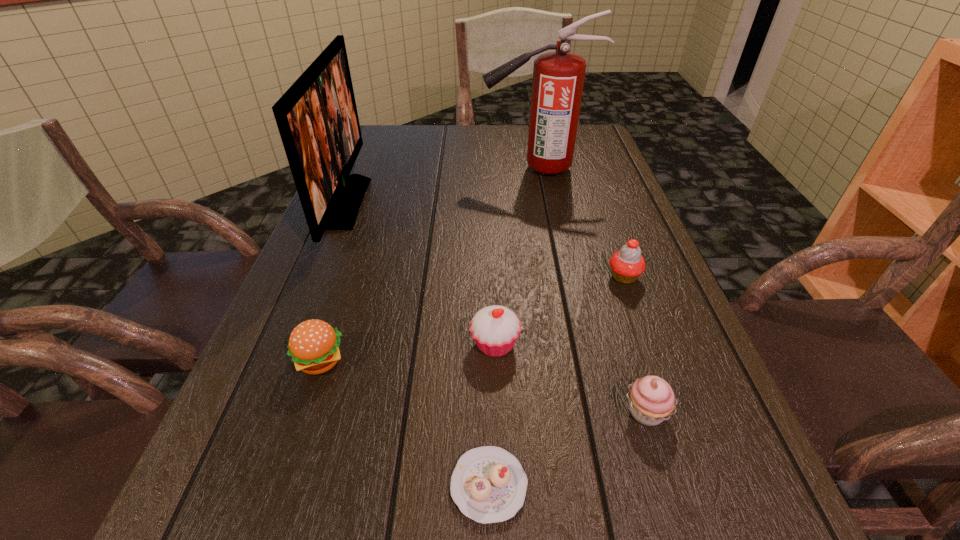
This screenshot has width=960, height=540. I want to click on fire extinguisher that is at the right edge, so [x=558, y=77].

In the image, there is a desktop. Find the location of `free space at the far edge`. free space at the far edge is located at coordinates (450, 153).

At what (x,y) coordinates should I click in order to perform the action: click on vacant area at the left edge. Please return your answer as a coordinate pair (x, y). Looking at the image, I should click on 383,164.

In the image, there is a desktop. Where is `vacant area at the right edge`? This screenshot has height=540, width=960. vacant area at the right edge is located at coordinates (585, 163).

Locate an element on the screen. The height and width of the screenshot is (540, 960). free region at the far right corner of the desktop is located at coordinates (596, 133).

Find the location of a particular element. blank region between the hamburger and the second tallest object is located at coordinates (333, 282).

Locate an element on the screen. free space between the second farthest cupcake and the fire extinguisher is located at coordinates (516, 256).

Identify the location of empty space between the third farthest object and the hamburger. (472, 319).

Locate an element on the screen. The height and width of the screenshot is (540, 960). vacant region between the fifth nearest object and the hamburger is located at coordinates (472, 319).

Where is `vacant space in between the second tallest object and the tallest object`? The image size is (960, 540). vacant space in between the second tallest object and the tallest object is located at coordinates (442, 186).